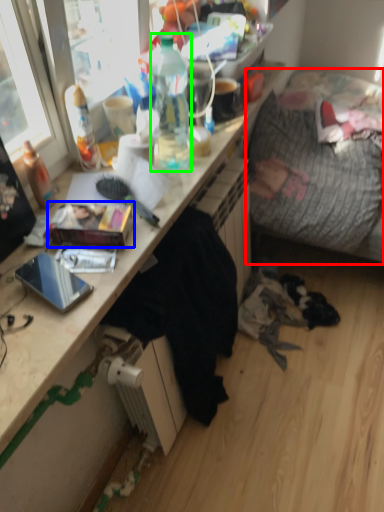
Question: Which object is the closest to the studio couch (highlighted by a red box)? Choose among these: book (highlighted by a blue box) or bottle (highlighted by a green box).

Choices:
 (A) book
 (B) bottle

Answer: (B)